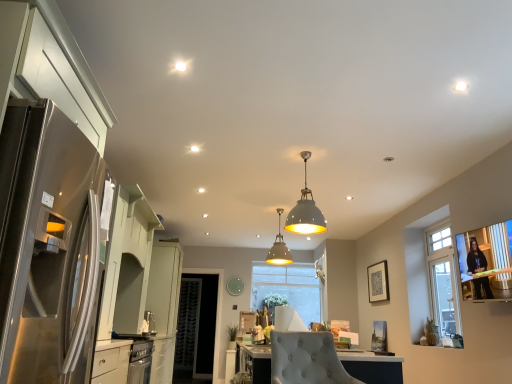
Question: From the image's perspective, is matte gray pendant light at center, the 1th lamp from the bottom, on stainless steel refrigerator at left?

Choices:
 (A) yes
 (B) no

Answer: (B)

Question: Does matte gray pendant light at center, which is the first lamp from back to front, turn towards stainless steel refrigerator at left?

Choices:
 (A) no
 (B) yes

Answer: (A)

Question: Can you confirm if matte gray pendant light at center, which is counted as the second lamp, starting from the front, is taller than stainless steel refrigerator at left?

Choices:
 (A) no
 (B) yes

Answer: (A)

Question: Can you confirm if matte gray pendant light at center, the 1th lamp from the bottom, is bigger than stainless steel refrigerator at left?

Choices:
 (A) no
 (B) yes

Answer: (A)

Question: Is the depth of matte gray pendant light at center, the 1th lamp from the bottom, greater than that of stainless steel refrigerator at left?

Choices:
 (A) yes
 (B) no

Answer: (A)

Question: Based on their sizes in the image, would you say stainless steel refrigerator at left is bigger or smaller than white matte pendant light at center, acting as the 2th lamp starting from the bottom?

Choices:
 (A) big
 (B) small

Answer: (A)

Question: From a real-world perspective, is stainless steel refrigerator at left positioned above or below white matte pendant light at center, acting as the 2th lamp starting from the bottom?

Choices:
 (A) above
 (B) below

Answer: (B)

Question: Considering their positions, is stainless steel refrigerator at left located in front of or behind white matte pendant light at center, acting as the 2th lamp starting from the bottom?

Choices:
 (A) front
 (B) behind

Answer: (A)

Question: Would you say stainless steel refrigerator at left is inside or outside white matte pendant light at center, acting as the first lamp starting from the top?

Choices:
 (A) outside
 (B) inside

Answer: (A)

Question: In terms of height, does clear glass door at center look taller or shorter compared to stainless steel refrigerator at left?

Choices:
 (A) tall
 (B) short

Answer: (A)

Question: Is point (188, 350) positioned closer to the camera than point (77, 337)?

Choices:
 (A) farther
 (B) closer

Answer: (A)

Question: Considering the positions of clear glass door at center and stainless steel refrigerator at left in the image, is clear glass door at center bigger or smaller than stainless steel refrigerator at left?

Choices:
 (A) small
 (B) big

Answer: (A)

Question: Is clear glass door at center in front of or behind stainless steel refrigerator at left in the image?

Choices:
 (A) front
 (B) behind

Answer: (B)

Question: Do you think matte gray pendant light at center, which is the first lamp from back to front, is within white glossy countertop at lower left, or outside of it?

Choices:
 (A) inside
 (B) outside

Answer: (B)

Question: Does point (x=270, y=253) appear closer or farther from the camera than point (x=159, y=360)?

Choices:
 (A) farther
 (B) closer

Answer: (A)